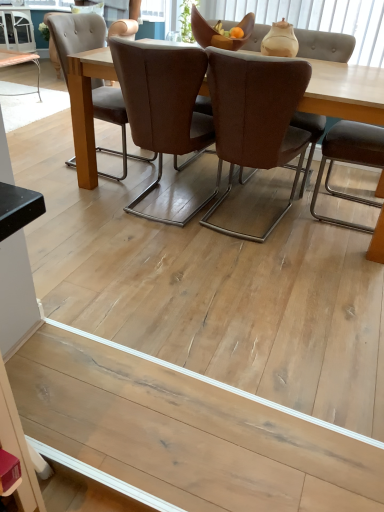
This screenshot has width=384, height=512. In order to click on natural wood floor at lower center in this screenshot , I will do `click(148, 445)`.

What do you see at coordinates (350, 161) in the screenshot? I see `brown leather chair at right, marked as the third chair in a left-to-right arrangement` at bounding box center [350, 161].

The image size is (384, 512). What do you see at coordinates (17, 30) in the screenshot?
I see `white glossy cabinet at upper left` at bounding box center [17, 30].

The height and width of the screenshot is (512, 384). What are the coordinates of `brown leather chair at center, which ranks as the first chair in left-to-right order` in the screenshot? It's located at (164, 105).

Locate an element on the screen. This screenshot has width=384, height=512. natural wood floor at lower center is located at coordinates (148, 445).

Is natural wood floor at lower center closer to the viewer compared to brown leather chair at right, which ranks as the first chair in right-to-left order?

That is True.

From the image's perspective, does natural wood floor at lower center appear higher than brown leather chair at right, which ranks as the first chair in right-to-left order?

No, from the image's perspective, natural wood floor at lower center is not above brown leather chair at right, which ranks as the first chair in right-to-left order.

Considering the positions of objects natural wood floor at lower center and brown leather chair at right, which ranks as the first chair in right-to-left order, in the image provided, who is more to the left, natural wood floor at lower center or brown leather chair at right, which ranks as the first chair in right-to-left order,?

Positioned to the left is natural wood floor at lower center.

Is brown fabric chair at center, which ranks as the 2th chair in right-to-left order, inside matte beige vase at upper center?

No, matte beige vase at upper center does not contain brown fabric chair at center, which ranks as the 2th chair in right-to-left order.

From the picture: Would you say matte beige vase at upper center is a long distance from brown fabric chair at center, which ranks as the 2th chair in right-to-left order?

Absolutely, matte beige vase at upper center is distant from brown fabric chair at center, which ranks as the 2th chair in right-to-left order.

At what (x,y) coordinates should I click in order to perform the action: click on window that appears behind the brown fabric chair at center, which ranks as the 2th chair in right-to-left order. Please return your answer as a coordinate pair (x, y). Looking at the image, I should click on coord(317,20).

How many degrees apart are the facing directions of matte beige vase at upper center and brown fabric chair at center, which ranks as the 2th chair in right-to-left order?

The facing directions of matte beige vase at upper center and brown fabric chair at center, which ranks as the 2th chair in right-to-left order, are 176 degrees apart.

Would you say brown leather chair at center, which ranks as the first chair in left-to-right order, is to the left or to the right of natural wood floor at lower center in the picture?

brown leather chair at center, which ranks as the first chair in left-to-right order, is to the left of natural wood floor at lower center.

Considering the positions of objects brown leather chair at center, positioned as the 3th chair in right-to-left order, and natural wood floor at lower center in the image provided, who is in front, brown leather chair at center, positioned as the 3th chair in right-to-left order, or natural wood floor at lower center?

natural wood floor at lower center is in front.

Measure the distance between brown leather chair at center, positioned as the 3th chair in right-to-left order, and natural wood floor at lower center.

brown leather chair at center, positioned as the 3th chair in right-to-left order, is 1.36 meters away from natural wood floor at lower center.

Is brown leather chair at center, which ranks as the first chair in left-to-right order, bigger or smaller than natural wood floor at lower center?

In the image, brown leather chair at center, which ranks as the first chair in left-to-right order, appears to be larger than natural wood floor at lower center.

Can you tell me how much white glossy cabinet at upper left and brown leather chair at right, which ranks as the first chair in right-to-left order, differ in facing direction?

white glossy cabinet at upper left and brown leather chair at right, which ranks as the first chair in right-to-left order, are facing 142 degrees away from each other.

Can you confirm if white glossy cabinet at upper left is thinner than brown leather chair at right, marked as the third chair in a left-to-right arrangement?

In fact, white glossy cabinet at upper left might be wider than brown leather chair at right, marked as the third chair in a left-to-right arrangement.

Does white glossy cabinet at upper left have a larger size compared to brown leather chair at right, which ranks as the first chair in right-to-left order?

Yes.

You are a GUI agent. You are given a task and a screenshot of the screen. Output one action in this format:
    pyautogui.click(x=<x>, y=<y>)
    Task: Click on the 1st chair in front of the white glossy cabinet at upper left
    This screenshot has width=384, height=512.
    Given the screenshot: What is the action you would take?
    pyautogui.click(x=350, y=161)

From the image's perspective, is brown leather chair at center, positioned as the 3th chair in right-to-left order, located above or below matte beige vase at upper center?

Clearly, from the image's perspective, brown leather chair at center, positioned as the 3th chair in right-to-left order, is below matte beige vase at upper center.

From a real-world perspective, is brown leather chair at center, which ranks as the first chair in left-to-right order, physically above matte beige vase at upper center?

No.

Is point (150, 106) positioned before point (301, 20)?

Yes, point (150, 106) is closer to viewer.

Is brown leather chair at center, which ranks as the first chair in left-to-right order, taller than matte beige vase at upper center?

Indeed, brown leather chair at center, which ranks as the first chair in left-to-right order, has a greater height compared to matte beige vase at upper center.

Could you tell me if brown fabric chair at center, which ranks as the 2th chair in right-to-left order, is facing brown leather chair at center, which ranks as the first chair in left-to-right order?

No.

Would you consider brown fabric chair at center, which ranks as the 2th chair in right-to-left order, to be distant from brown leather chair at center, which ranks as the first chair in left-to-right order?

That's not correct — brown fabric chair at center, which ranks as the 2th chair in right-to-left order, is a little close to brown leather chair at center, which ranks as the first chair in left-to-right order.

Is brown leather chair at center, positioned as the 3th chair in right-to-left order, surrounded by brown fabric chair at center, which appears as the second chair when viewed from the left?

No, brown leather chair at center, positioned as the 3th chair in right-to-left order, is located outside of brown fabric chair at center, which appears as the second chair when viewed from the left.

Considering the positions of objects brown fabric chair at center, which ranks as the 2th chair in right-to-left order, and brown leather chair at center, positioned as the 3th chair in right-to-left order, in the image provided, who is behind, brown fabric chair at center, which ranks as the 2th chair in right-to-left order, or brown leather chair at center, positioned as the 3th chair in right-to-left order,?

brown leather chair at center, positioned as the 3th chair in right-to-left order, is behind.

Considering their positions, is brown fabric chair at center, which ranks as the 2th chair in right-to-left order, located in front of or behind white glossy cabinet at upper left?

brown fabric chair at center, which ranks as the 2th chair in right-to-left order, is in front of white glossy cabinet at upper left.

The height and width of the screenshot is (512, 384). I want to click on screen door on the left of brown fabric chair at center, which appears as the second chair when viewed from the left, so click(17, 30).

Is brown fabric chair at center, which ranks as the 2th chair in right-to-left order, at the left side of white glossy cabinet at upper left?

No, brown fabric chair at center, which ranks as the 2th chair in right-to-left order, is not to the left of white glossy cabinet at upper left.

The width and height of the screenshot is (384, 512). I want to click on plank on the left of brown leather chair at right, which ranks as the first chair in right-to-left order, so click(148, 445).

The width and height of the screenshot is (384, 512). Find the location of `window behind the brown fabric chair at center, which appears as the second chair when viewed from the left`. window behind the brown fabric chair at center, which appears as the second chair when viewed from the left is located at coordinates [317, 20].

In the scene shown: From the image, which object appears to be farther from brown leather chair at right, which ranks as the first chair in right-to-left order, brown fabric chair at center, which appears as the second chair when viewed from the left, or brown leather chair at center, positioned as the 3th chair in right-to-left order?

brown leather chair at center, positioned as the 3th chair in right-to-left order, is further to brown leather chair at right, which ranks as the first chair in right-to-left order.

Which object lies nearer to the anchor point brown leather chair at center, positioned as the 3th chair in right-to-left order, brown fabric chair at center, which ranks as the 2th chair in right-to-left order, or natural wood floor at lower center?

Based on the image, brown fabric chair at center, which ranks as the 2th chair in right-to-left order, appears to be nearer to brown leather chair at center, positioned as the 3th chair in right-to-left order.

Considering their positions, is natural wood floor at lower center positioned further to matte beige vase at upper center than white glossy cabinet at upper left?

Among the two, natural wood floor at lower center is located further to matte beige vase at upper center.

From the image, which object appears to be farther from natural wood floor at lower center, brown fabric chair at center, which appears as the second chair when viewed from the left, or white glossy cabinet at upper left?

white glossy cabinet at upper left is further to natural wood floor at lower center.

Based on the photo, which object lies nearer to the anchor point brown leather chair at right, which ranks as the first chair in right-to-left order, brown leather chair at center, positioned as the 3th chair in right-to-left order, or natural wood floor at lower center?

brown leather chair at center, positioned as the 3th chair in right-to-left order, is closer to brown leather chair at right, which ranks as the first chair in right-to-left order.

When comparing their distances from matte beige vase at upper center, does brown leather chair at right, which ranks as the first chair in right-to-left order, or natural wood floor at lower center seem further?

natural wood floor at lower center is positioned further to the anchor matte beige vase at upper center.

Looking at the image, which one is located further to natural wood floor at lower center, brown fabric chair at center, which appears as the second chair when viewed from the left, or brown leather chair at center, positioned as the 3th chair in right-to-left order?

Based on the image, brown fabric chair at center, which appears as the second chair when viewed from the left, appears to be further to natural wood floor at lower center.

From the image, which object appears to be nearer to matte beige vase at upper center, brown leather chair at right, marked as the third chair in a left-to-right arrangement, or white glossy cabinet at upper left?

brown leather chair at right, marked as the third chair in a left-to-right arrangement, is closer to matte beige vase at upper center.

Where is `window positioned between brown leather chair at center, positioned as the 3th chair in right-to-left order, and white glossy cabinet at upper left from near to far`? This screenshot has width=384, height=512. window positioned between brown leather chair at center, positioned as the 3th chair in right-to-left order, and white glossy cabinet at upper left from near to far is located at coordinates (317, 20).

Find the location of a particular element. window located between white glossy cabinet at upper left and brown leather chair at right, marked as the third chair in a left-to-right arrangement, in the left-right direction is located at coordinates (317, 20).

At what (x,y) coordinates should I click in order to perform the action: click on window between brown leather chair at center, which ranks as the first chair in left-to-right order, and brown leather chair at right, which ranks as the first chair in right-to-left order, in the horizontal direction. Please return your answer as a coordinate pair (x, y). Looking at the image, I should click on point(317,20).

What are the coordinates of `window between natural wood floor at lower center and white glossy cabinet at upper left along the z-axis` in the screenshot? It's located at (317, 20).